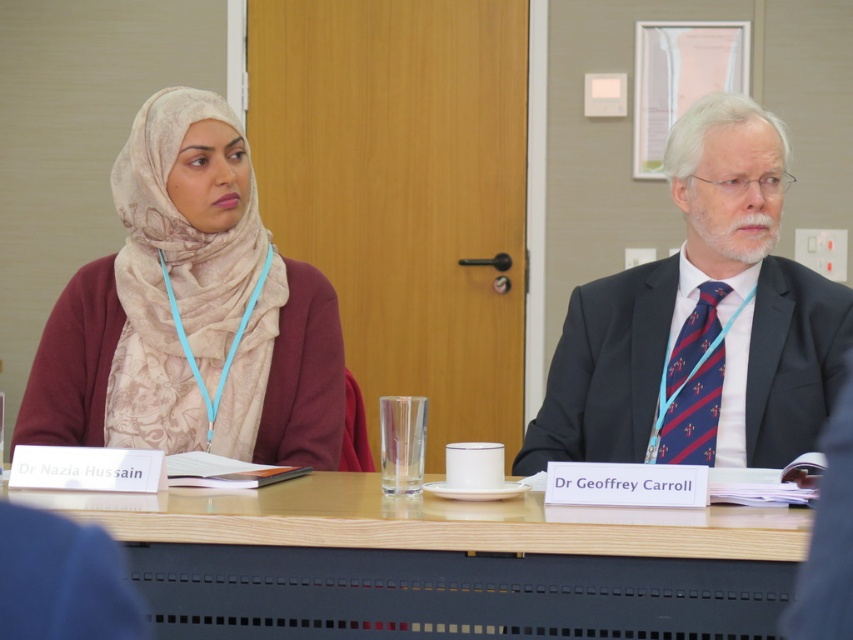
You are a photographer adjusting your camera to focus on two points in the image. The first point is at coordinates point (744, 248) and the second is at point (682, 417). Which point should you focus on first if you want to ensure both are in focus, starting from the one closer to the camera?

You should focus on point (744, 248) first because it is closer to the camera than point (682, 417). After adjusting for this closer point, the farther point will naturally come into focus as well.

What are the coordinates of the dark blue suit at right?

The dark blue suit at right is located at coordinates point [701,321].

You are organizing a small conference and need to place a 1.2 meter long presentation board on the wooden table at center. Considering the size of the table compared to the dark blue striped tie at right, can the presentation board fit on the table?

The wooden table at center is bigger than the dark blue striped tie at right, but the size comparison between the table and the tie does not provide information about the table dimensions required to fit a 1.2 meter long presentation board. Therefore, it is uncertain if the presentation board will fit on the table based on the given information.